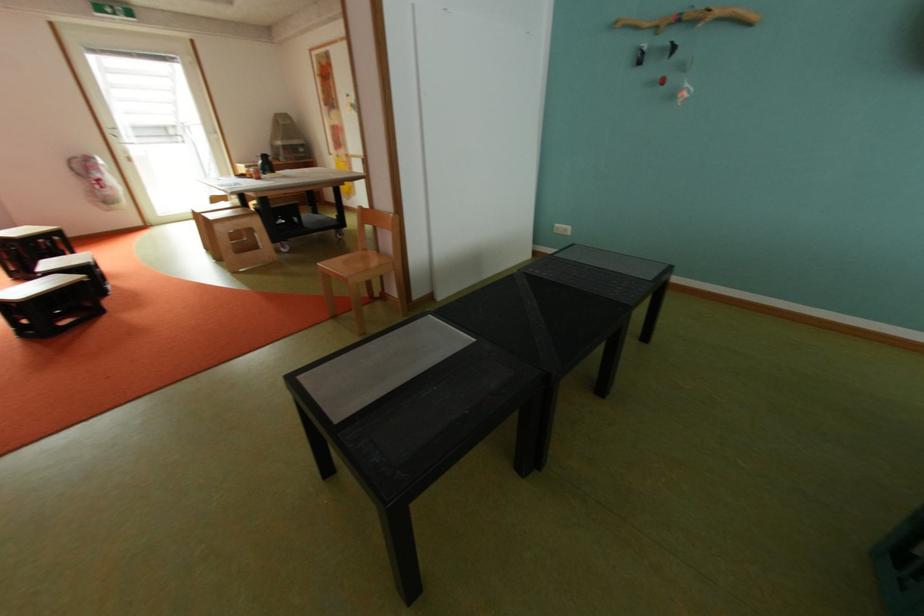
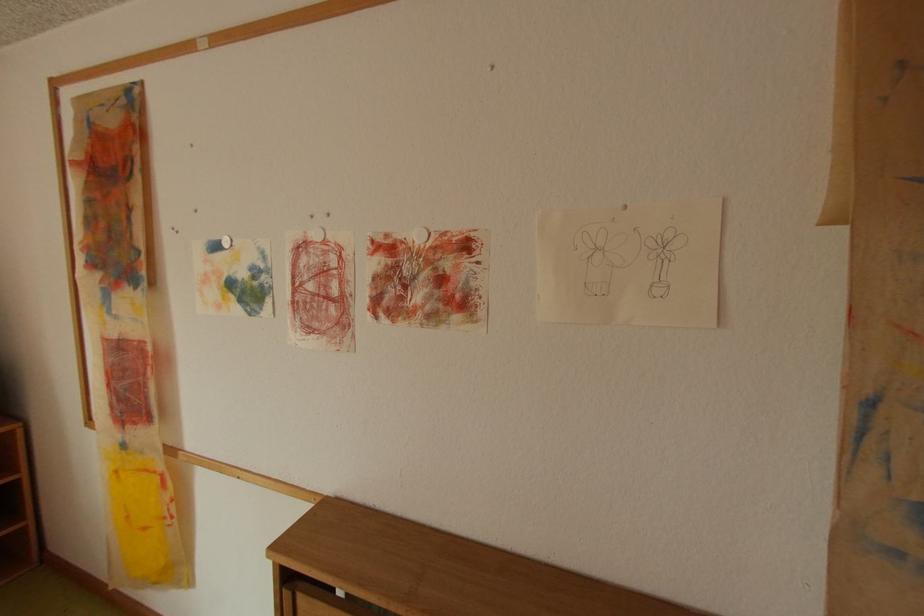
In the second image, find the point that corresponds to the point at 347,156 in the first image.

(134, 446)